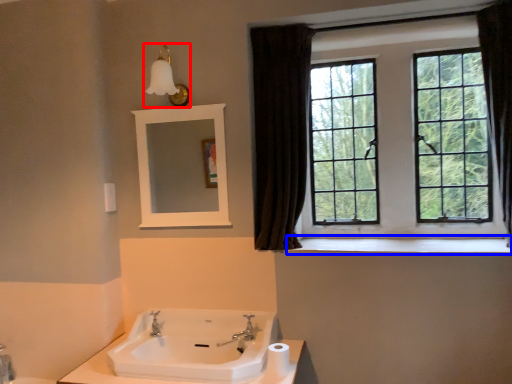
Question: Among these objects, which one is nearest to the camera, light fixture (highlighted by a red box) or window sill (highlighted by a blue box)?

Choices:
 (A) light fixture
 (B) window sill

Answer: (B)